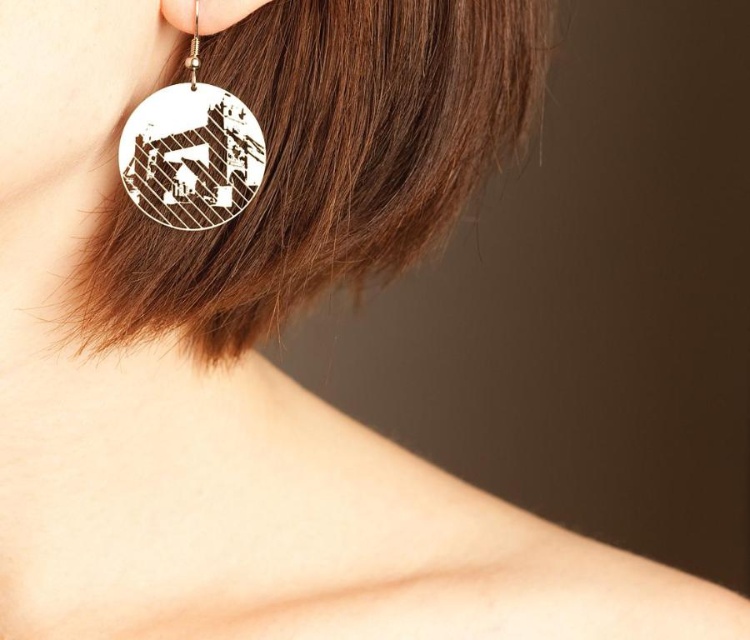
Is white wood circle at left further to the viewer compared to silver metallic earring at upper left?

Yes, white wood circle at left is further from the viewer.

Does point (246, 122) come behind point (212, 22)?

Yes, point (246, 122) is farther from viewer.

This screenshot has height=640, width=750. What are the coordinates of `white wood circle at left` in the screenshot? It's located at (192, 150).

Which is more to the right, brown matte hair at upper left or white wood circle at left?

brown matte hair at upper left is more to the right.

Who is more distant from viewer, [422,81] or [156,132]?

Point [422,81]

The height and width of the screenshot is (640, 750). Identify the location of brown matte hair at upper left. (324, 161).

Which of these two, brown matte hair at upper left or silver metallic earring at upper left, stands shorter?

Standing shorter between the two is silver metallic earring at upper left.

Between brown matte hair at upper left and silver metallic earring at upper left, which one appears on the right side from the viewer's perspective?

From the viewer's perspective, brown matte hair at upper left appears more on the right side.

Where is `brown matte hair at upper left`? The height and width of the screenshot is (640, 750). brown matte hair at upper left is located at coordinates (324, 161).

The image size is (750, 640). Identify the location of brown matte hair at upper left. (324, 161).